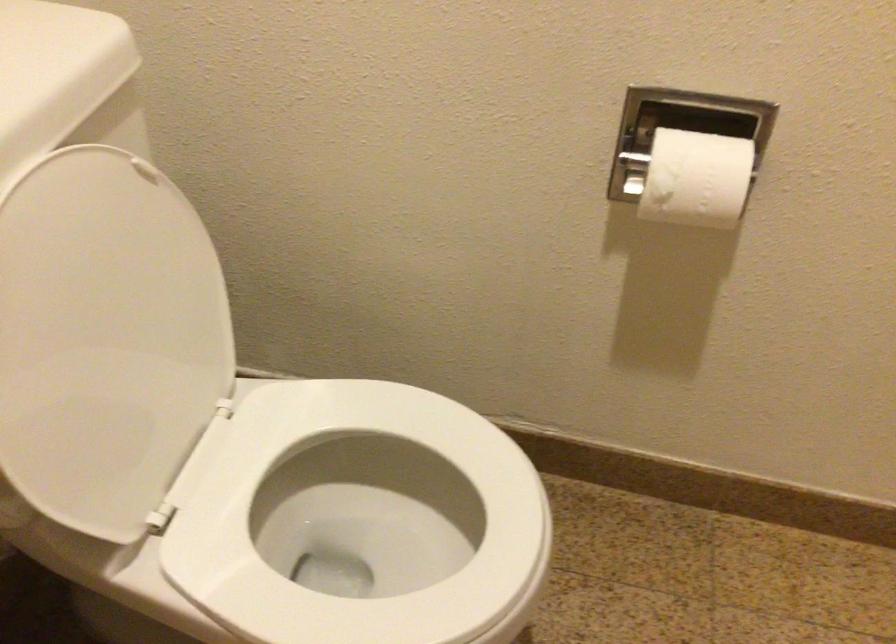
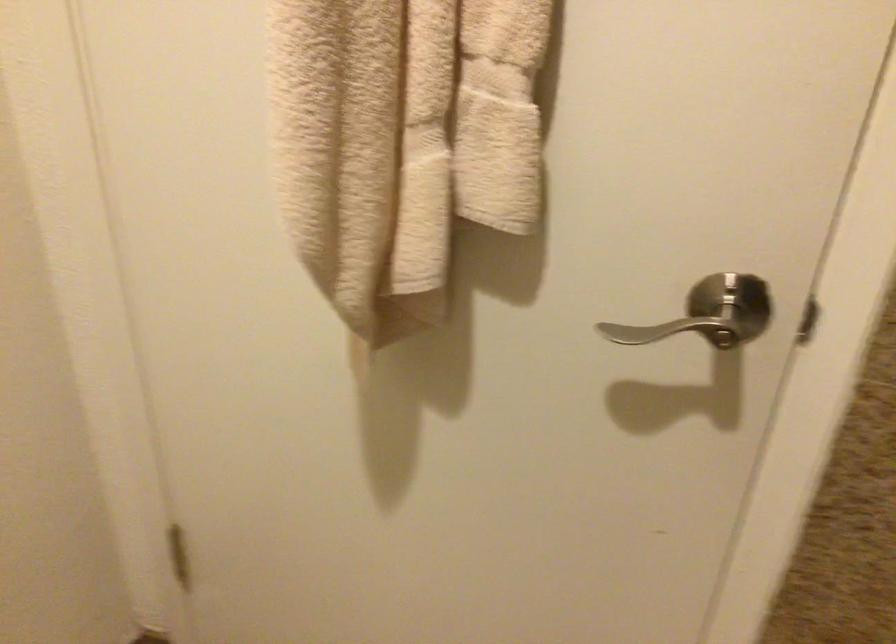
Based on the continuous images, in which direction is the camera rotating?

The rotation direction of the camera is right-down.